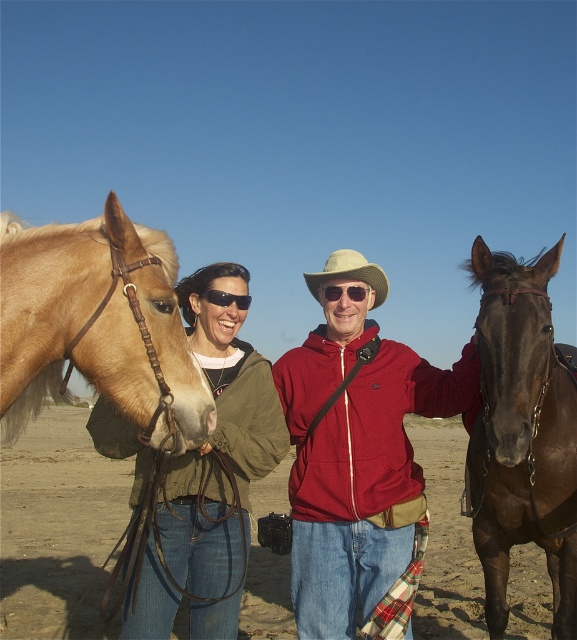
Question: Is matte red hoodie at center to the right of sunglasses at center from the viewer's perspective?

Choices:
 (A) no
 (B) yes

Answer: (B)

Question: Is beige fabric cowboy hat at center positioned behind sunglasses at center?

Choices:
 (A) yes
 (B) no

Answer: (A)

Question: Considering the real-world distances, which object is farthest from the black plastic goggles at center?

Choices:
 (A) matte red hoodie at center
 (B) dull brown dirt at center
 (C) sunglasses at center
 (D) matte green jacket at center

Answer: (B)

Question: Which of the following is the farthest from the observer?

Choices:
 (A) brown glossy horse at right
 (B) beige fabric cowboy hat at center
 (C) dull brown dirt at center
 (D) light brown leather horse at left

Answer: (C)

Question: Is matte red hoodie at center thinner than beige fabric cowboy hat at center?

Choices:
 (A) yes
 (B) no

Answer: (B)

Question: Which of the following is the farthest from the observer?

Choices:
 (A) (88, 516)
 (B) (84, 266)
 (C) (222, 294)

Answer: (A)